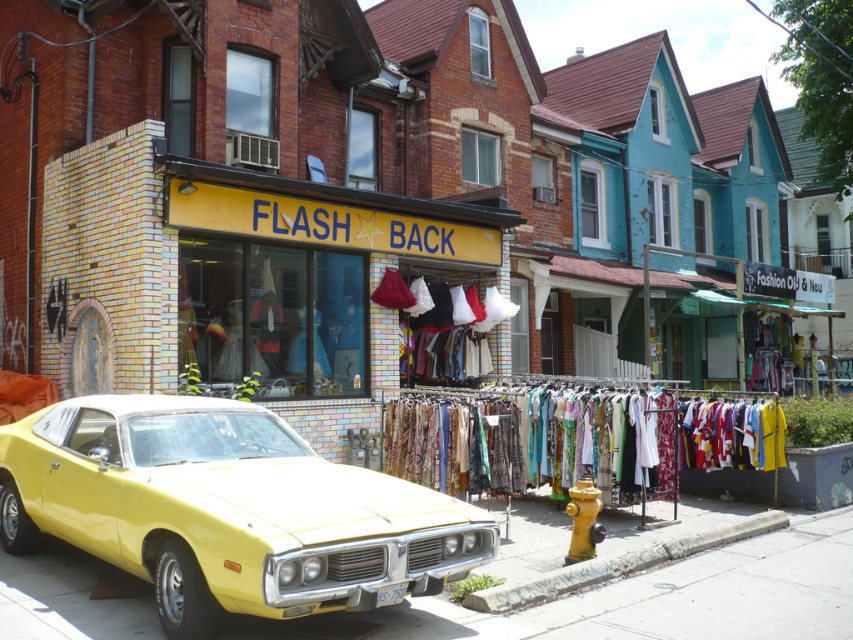
Question: Is the position of shiny yellow car at center less distant than that of smooth concrete curb at lower center?

Choices:
 (A) no
 (B) yes

Answer: (B)

Question: Among these points, which one is farthest from the camera?

Choices:
 (A) (570, 490)
 (B) (650, 563)
 (C) (219, 486)
 (D) (610, 586)

Answer: (A)

Question: From the image, what is the correct spatial relationship of smooth concrete curb at lower center in relation to yellow matte fire hydrant at lower center?

Choices:
 (A) right
 (B) left

Answer: (A)

Question: Which object is positioned farthest from the yellow matte fire hydrant at lower center?

Choices:
 (A) yellow concrete pavement at lower left
 (B) smooth concrete curb at lower center
 (C) shiny yellow car at center

Answer: (C)

Question: Which of the following is the closest to the observer?

Choices:
 (A) (583, 500)
 (B) (479, 592)
 (C) (811, 589)

Answer: (B)

Question: Can you confirm if yellow concrete pavement at lower left is wider than yellow matte fire hydrant at lower center?

Choices:
 (A) no
 (B) yes

Answer: (B)